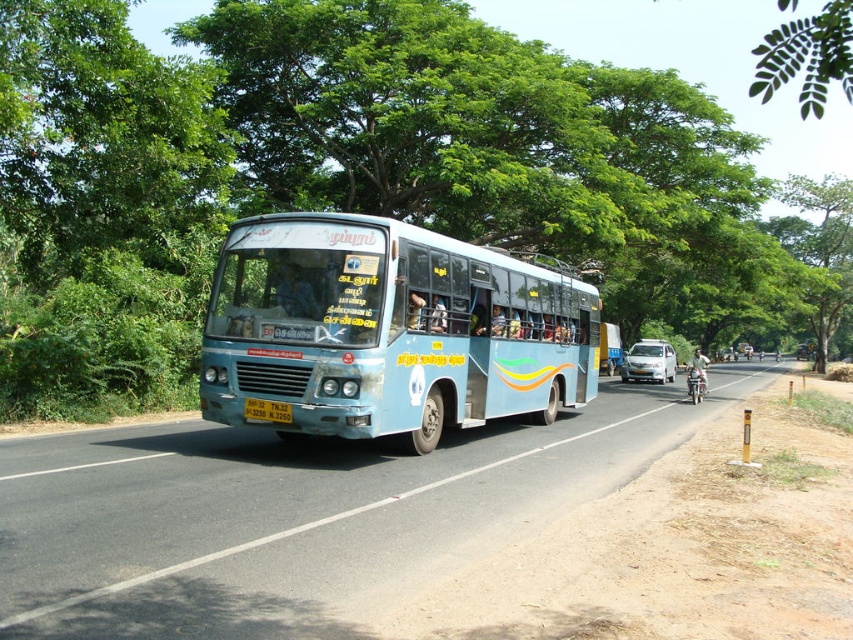
Is point (387, 125) positioned in front of point (265, 410)?

That is False.

Which of these two, green leafy tree at upper center or yellow metallic license plate at center, stands taller?

green leafy tree at upper center is taller.

At what (x,y) coordinates should I click in order to perform the action: click on green leafy tree at upper center. Please return your answer as a coordinate pair (x, y). Looking at the image, I should click on (341, 176).

Does blue matte bus at center have a smaller size compared to yellow metallic license plate at center?

No.

Can you confirm if blue matte bus at center is wider than yellow metallic license plate at center?

Indeed, blue matte bus at center has a greater width compared to yellow metallic license plate at center.

What do you see at coordinates (390, 330) in the screenshot? The image size is (853, 640). I see `blue matte bus at center` at bounding box center [390, 330].

Find the location of a particular element. blue matte bus at center is located at coordinates (390, 330).

Which is more to the left, green leafy tree at upper center or metallic silver motorcycle at right?

From the viewer's perspective, metallic silver motorcycle at right appears more on the left side.

Can you confirm if green leafy tree at upper center is bigger than metallic silver motorcycle at right?

Indeed, green leafy tree at upper center has a larger size compared to metallic silver motorcycle at right.

Find the location of `green leafy tree at upper center`. green leafy tree at upper center is located at coordinates (341, 176).